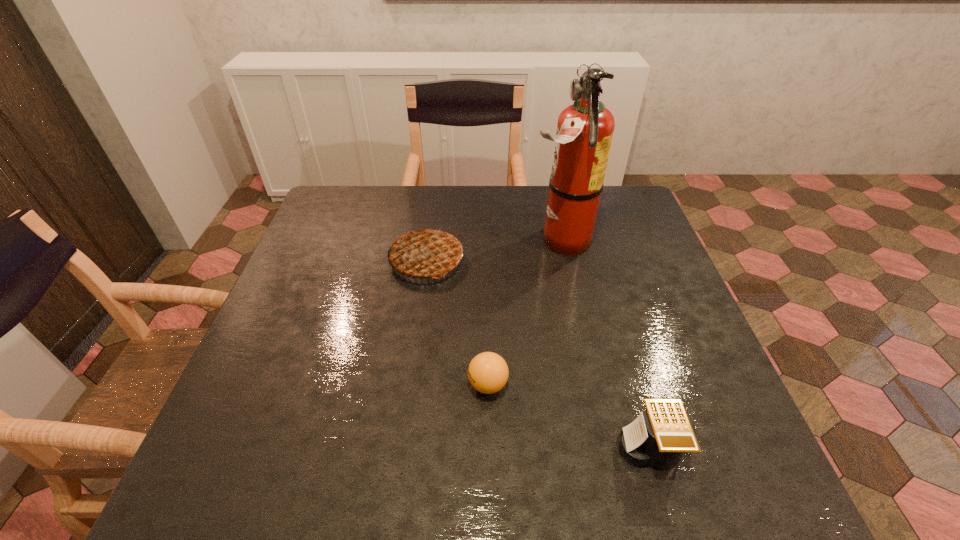
This screenshot has height=540, width=960. What are the coordinates of `vacant space that satisfies the following two spatial constraints: 1. on the side with brand of the ping-pong ball; 2. on the back side of the calculator` in the screenshot? It's located at (489, 448).